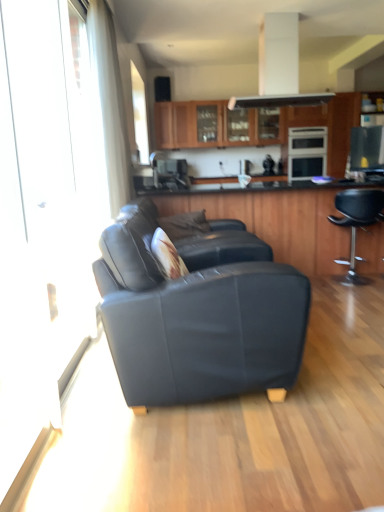
Question: Considering the relative sizes of satin black microwave at upper right, the first appliance when ordered from front to back, and satin black oven at center, marked as the second appliance in a front-to-back arrangement, in the image provided, is satin black microwave at upper right, the first appliance when ordered from front to back, smaller than satin black oven at center, marked as the second appliance in a front-to-back arrangement,?

Choices:
 (A) yes
 (B) no

Answer: (A)

Question: Considering the relative positions of satin black microwave at upper right, arranged as the 2th appliance when viewed from the back, and satin black oven at center, which is counted as the second appliance, starting from the bottom, in the image provided, is satin black microwave at upper right, arranged as the 2th appliance when viewed from the back, to the left of satin black oven at center, which is counted as the second appliance, starting from the bottom, from the viewer's perspective?

Choices:
 (A) yes
 (B) no

Answer: (A)

Question: From a real-world perspective, is satin black microwave at upper right, which appears as the first appliance when ordered from the bottom, physically above satin black oven at center, which is the 1th appliance from top to bottom?

Choices:
 (A) no
 (B) yes

Answer: (B)

Question: Is satin black microwave at upper right, arranged as the 2th appliance when viewed from the back, oriented towards satin black oven at center, which is the 1th appliance from top to bottom?

Choices:
 (A) yes
 (B) no

Answer: (B)

Question: Considering the relative sizes of satin black microwave at upper right, which is counted as the second appliance, starting from the top, and satin black oven at center, which is the 1th appliance from top to bottom, in the image provided, is satin black microwave at upper right, which is counted as the second appliance, starting from the top, wider than satin black oven at center, which is the 1th appliance from top to bottom,?

Choices:
 (A) yes
 (B) no

Answer: (B)

Question: From their relative heights in the image, would you say wooden cabinet at center, acting as the second cabinetry starting from the top, is taller or shorter than satin black oven at center, the 1th appliance positioned from the back?

Choices:
 (A) short
 (B) tall

Answer: (B)

Question: From a real-world perspective, relative to satin black oven at center, marked as the second appliance in a front-to-back arrangement, is wooden cabinet at center, placed as the second cabinetry when sorted from back to front, vertically above or below?

Choices:
 (A) below
 (B) above

Answer: (A)

Question: Is point (304, 256) positioned closer to the camera than point (317, 154)?

Choices:
 (A) closer
 (B) farther

Answer: (A)

Question: From the image's perspective, is wooden cabinet at center, placed as the second cabinetry when sorted from back to front, above or below satin black oven at center, which is the 1th appliance from top to bottom?

Choices:
 (A) above
 (B) below

Answer: (B)

Question: Based on their sizes in the image, would you say wooden cabinets at upper center, placed as the second cabinetry when sorted from front to back, is bigger or smaller than wooden cabinet at center, the first cabinetry ordered from the bottom?

Choices:
 (A) big
 (B) small

Answer: (B)

Question: From a real-world perspective, relative to wooden cabinet at center, placed as the second cabinetry when sorted from back to front, is wooden cabinets at upper center, placed as the second cabinetry when sorted from front to back, vertically above or below?

Choices:
 (A) below
 (B) above

Answer: (B)

Question: Which is correct: wooden cabinets at upper center, which is counted as the first cabinetry, starting from the back, is inside wooden cabinet at center, acting as the second cabinetry starting from the top, or outside of it?

Choices:
 (A) outside
 (B) inside

Answer: (A)

Question: In terms of height, does wooden cabinets at upper center, which is the 1th cabinetry from top to bottom, look taller or shorter compared to wooden cabinet at center, which is the 1th cabinetry from front to back?

Choices:
 (A) short
 (B) tall

Answer: (A)

Question: Would you say satin black oven at center, which is the 1th appliance from top to bottom, is inside or outside wooden cabinets at upper center, placed as the second cabinetry when sorted from front to back?

Choices:
 (A) outside
 (B) inside

Answer: (A)

Question: In the image, is satin black oven at center, marked as the second appliance in a front-to-back arrangement, positioned in front of or behind wooden cabinets at upper center, arranged as the second cabinetry when ordered from the bottom?

Choices:
 (A) front
 (B) behind

Answer: (A)